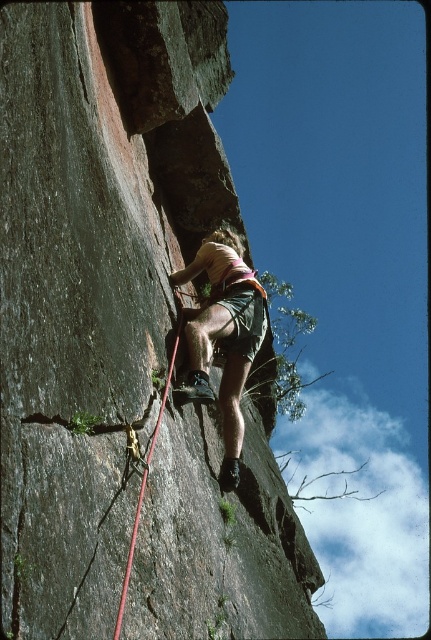
You are a photographer capturing the climber. You notice the matte pink shorts at center and the red nylon rope at center. Which object is positioned to the right side when looking at the image?

The matte pink shorts at center are to the right of the red nylon rope at center.

You are a rock climber looking at the cliff face. You notice two points marked on the rock. The first point is at coordinates point (x=231, y=307) and the second is at point (x=124, y=596). Which point is closer to you?

Point (x=231, y=307) is further to the viewer than point (x=124, y=596), so the point closer to you is point (x=124, y=596).

You are a rock climbing instructor observing the climber. You need to check if the climber is properly secured. Based on the image, is the matte pink shorts at center positioned above or below the red nylon rope at center?

The matte pink shorts at center is above the red nylon rope at center, which means the climber is properly secured as the rope is below their shorts.